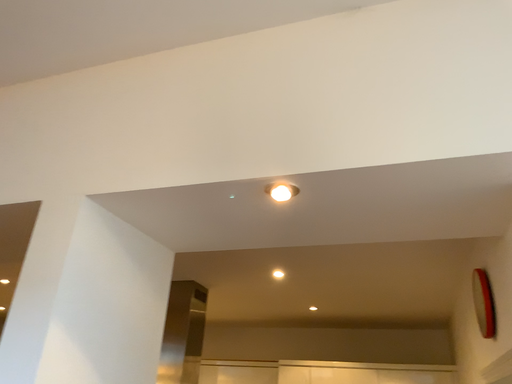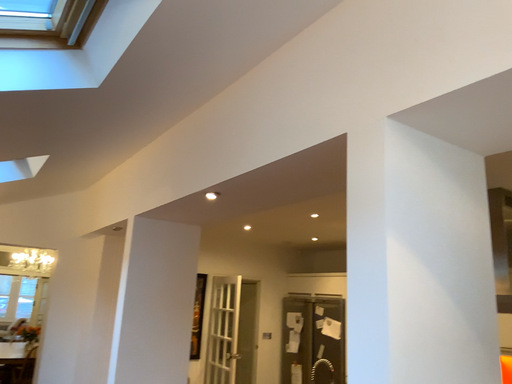
Question: How did the camera likely rotate when shooting the video?

Choices:
 (A) rotated upward
 (B) rotated downward

Answer: (B)